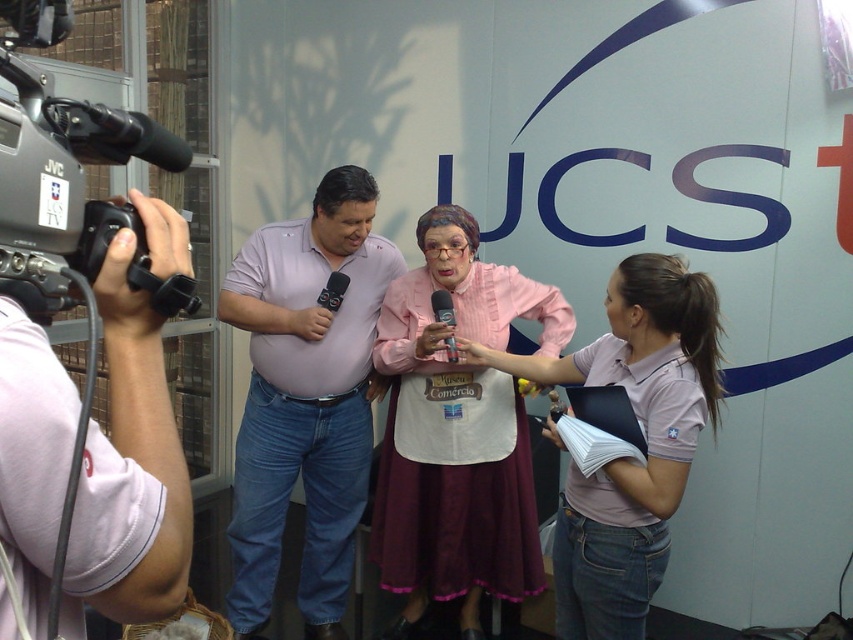
Between metallic black microphone at center and black matte microphone at center, which one is positioned higher?

black matte microphone at center is above.

Can you confirm if metallic black microphone at center is positioned to the right of black matte microphone at center?

Indeed, metallic black microphone at center is positioned on the right side of black matte microphone at center.

What do you see at coordinates (444, 307) in the screenshot?
I see `metallic black microphone at center` at bounding box center [444, 307].

Where is `metallic black microphone at center`? metallic black microphone at center is located at coordinates (444, 307).

Does light purple shirt at center have a lesser width compared to metallic black microphone at center?

Incorrect, light purple shirt at center's width is not less than metallic black microphone at center's.

Which is more to the right, light purple shirt at center or metallic black microphone at center?

metallic black microphone at center

Locate an element on the screen. light purple shirt at center is located at coordinates (305, 397).

Consider the image. Can you confirm if black plastic video camera at left is positioned below metallic black microphone at center?

No.

Who is more forward, (15, 221) or (444, 323)?

Point (15, 221) is more forward.

At what (x,y) coordinates should I click in order to perform the action: click on black plastic video camera at left. Please return your answer as a coordinate pair (x, y). The height and width of the screenshot is (640, 853). Looking at the image, I should click on (68, 179).